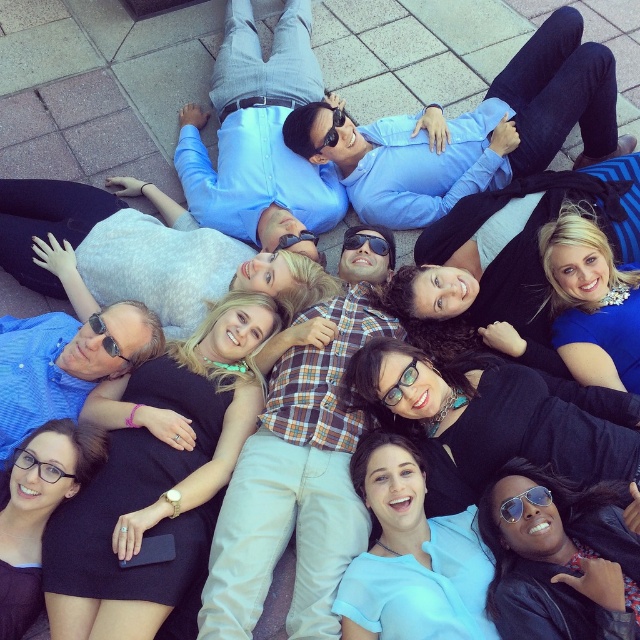
Question: Which object is farther from the camera taking this photo?

Choices:
 (A) matte black dress at center
 (B) black matte shirt at center

Answer: (B)

Question: Is blue fabric dress at center above clear plastic glasses at center?

Choices:
 (A) no
 (B) yes

Answer: (B)

Question: Which object is the closest to the black plastic sunglasses at upper center?

Choices:
 (A) aviator sunglasses at lower right
 (B) matte black dress at center

Answer: (B)

Question: Can you confirm if matte black dress at center is positioned to the right of aviator sunglasses at lower right?

Choices:
 (A) no
 (B) yes

Answer: (A)

Question: Based on their relative distances, which object is farther from the blue fabric dress at center?

Choices:
 (A) clear plastic glasses at center
 (B) black matte shirt at center
 (C) aviator sunglasses at lower right
 (D) black dress at center

Answer: (D)

Question: Does light blue shirt at center appear over blue fabric dress at center?

Choices:
 (A) no
 (B) yes

Answer: (B)